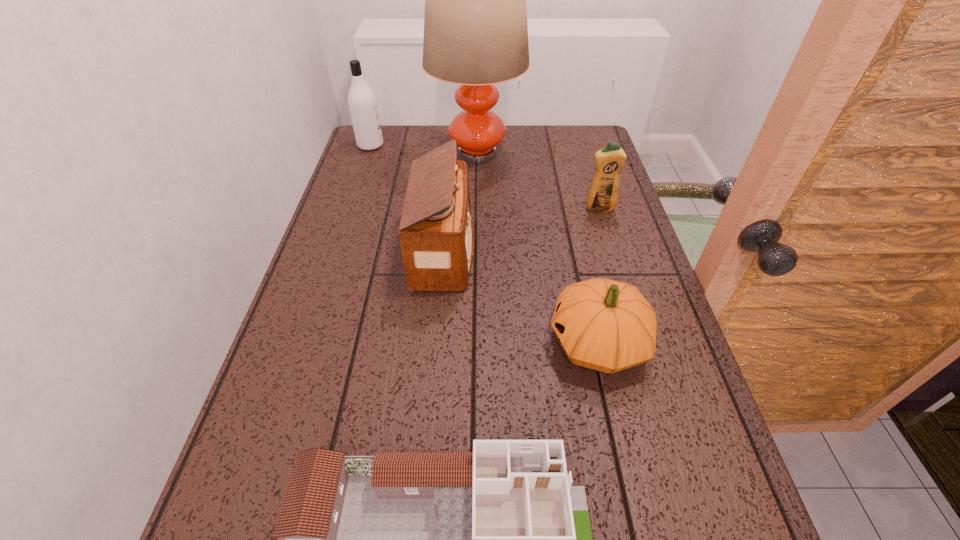
This screenshot has height=540, width=960. I want to click on the tallest object, so click(x=475, y=26).

Locate an element on the screen. The width and height of the screenshot is (960, 540). the leftmost object is located at coordinates (362, 103).

Image resolution: width=960 pixels, height=540 pixels. I want to click on the fourth farthest object, so click(x=436, y=236).

I want to click on the fourth tallest object, so click(x=603, y=195).

Identify the location of the fourth nearest object. The image size is (960, 540). (603, 195).

The height and width of the screenshot is (540, 960). Identify the location of gourd. (605, 325).

You are a GUI agent. You are given a task and a screenshot of the screen. Output one action in this format:
    pyautogui.click(x=<x>, y=<y>)
    Task: Click on the free space located 0.180m on the front of the lamp
    
    Given the screenshot: What is the action you would take?
    pyautogui.click(x=476, y=216)

Image resolution: width=960 pixels, height=540 pixels. Identify the location of vacant area located 0.260m on the front-facing side of the leftmost object. (461, 145).

Find the location of a particular element. vacant position located 0.340m on the front panel of the third nearest object is located at coordinates (608, 252).

Image resolution: width=960 pixels, height=540 pixels. I want to click on blank area located on the label of the detergent, so click(609, 238).